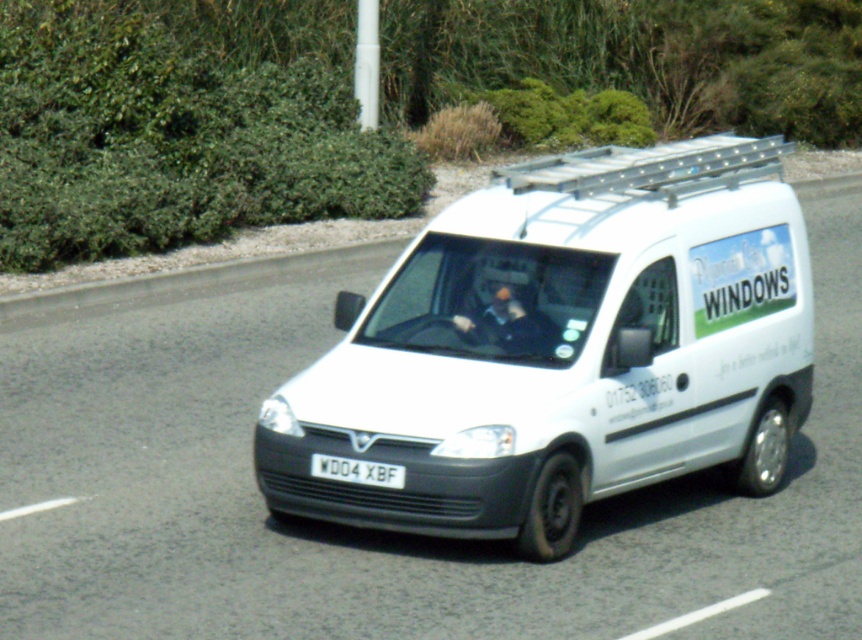
Question: Which of the following is the closest to the observer?

Choices:
 (A) green leafy hedge at upper left
 (B) white matte van at center
 (C) white plastic license plate at center

Answer: (B)

Question: Can you confirm if white matte van at center is positioned above white plastic license plate at center?

Choices:
 (A) no
 (B) yes

Answer: (B)

Question: Does white matte van at center appear on the left side of white plastic license plate at center?

Choices:
 (A) yes
 (B) no

Answer: (B)

Question: Which is nearer to the white plastic license plate at center?

Choices:
 (A) white matte van at center
 (B) green leafy hedge at upper left

Answer: (A)

Question: Considering the real-world distances, which object is closest to the white matte van at center?

Choices:
 (A) green leafy hedge at upper left
 (B) white plastic license plate at center

Answer: (B)

Question: Does white matte van at center appear on the left side of green leafy hedge at upper left?

Choices:
 (A) yes
 (B) no

Answer: (B)